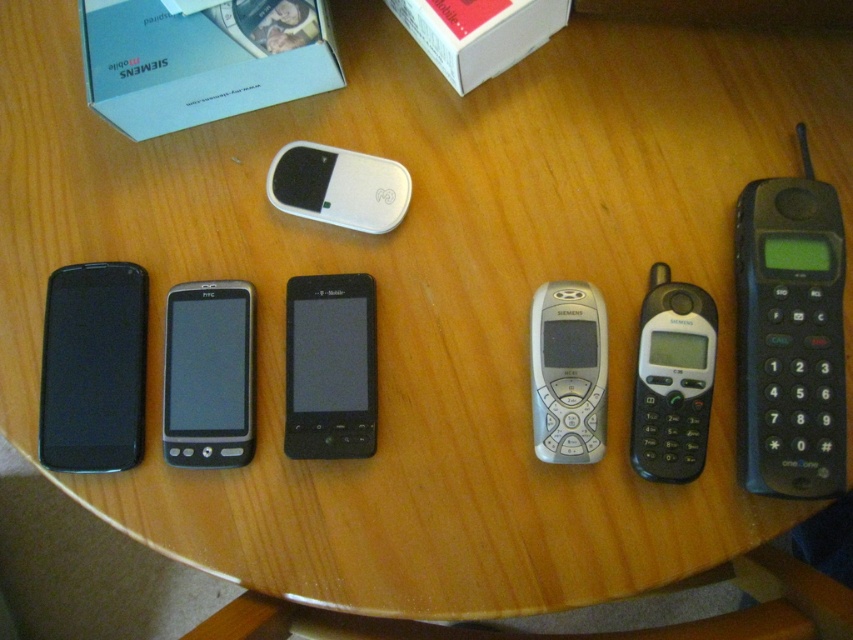
Is point (239, 365) in front of point (363, 177)?

Yes, point (239, 365) is closer to viewer.

This screenshot has height=640, width=853. I want to click on black glossy htc phone at center, so click(x=209, y=374).

Locate an element on the screen. black glossy htc phone at center is located at coordinates (209, 374).

Between black plastic phone at right and white glossy mouse at center, which one appears on the right side from the viewer's perspective?

black plastic phone at right is more to the right.

Which is behind, point (733, 252) or point (361, 179)?

Positioned behind is point (361, 179).

Where is `black plastic phone at right`? This screenshot has width=853, height=640. black plastic phone at right is located at coordinates (790, 336).

Does black plastic phone at right have a greater width compared to white cardboard box at upper left?

Incorrect, black plastic phone at right's width does not surpass white cardboard box at upper left's.

Which is more to the left, black plastic phone at right or white cardboard box at upper left?

Positioned to the left is white cardboard box at upper left.

Locate an element on the screen. black plastic phone at right is located at coordinates (790, 336).